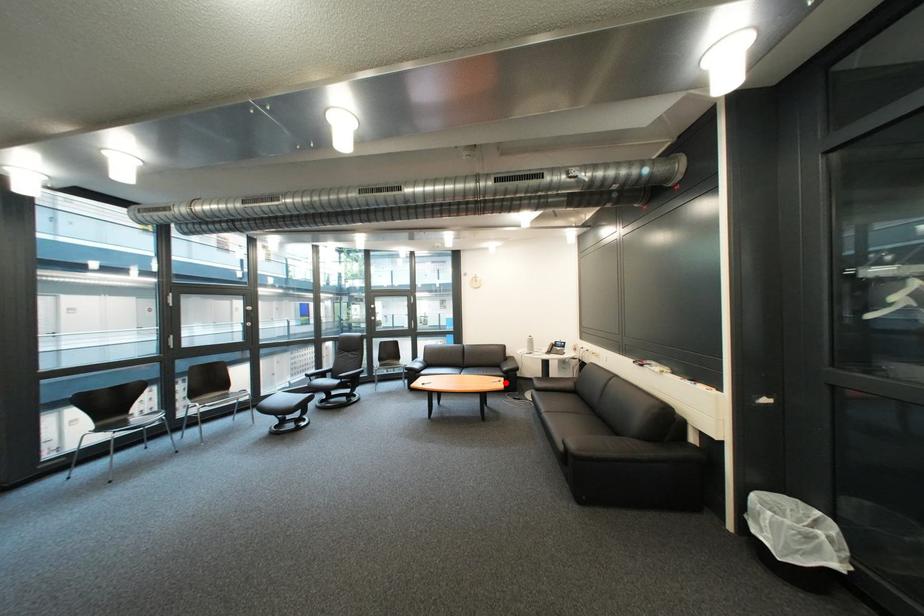
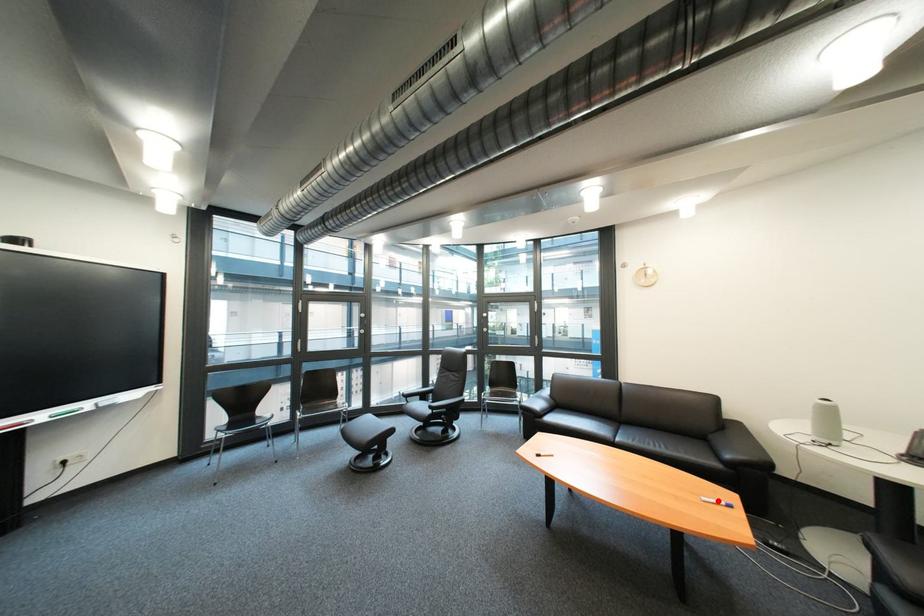
I am providing you with two images of the same scene from different viewpoints. A red point is marked on the first image and another point is marked on the second image. Do the highlighted points in image1 and image2 indicate the same real-world spot?

Yes